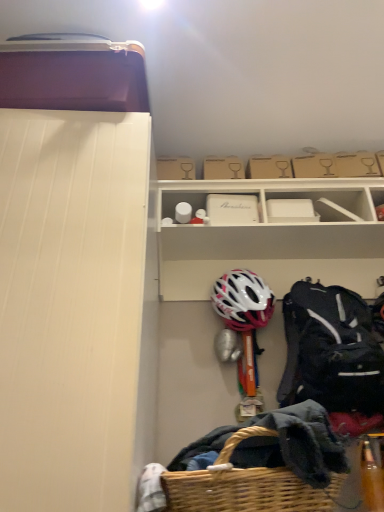
Question: From the image's perspective, relative to white matte storage box at upper center, the second storage box positioned from the top, is black synthetic backpack at right above or below?

Choices:
 (A) above
 (B) below

Answer: (B)

Question: Do you think black synthetic backpack at right is within white matte storage box at upper center, the second storage box positioned from the top, or outside of it?

Choices:
 (A) inside
 (B) outside

Answer: (B)

Question: Based on their relative distances, which object is nearer to the white plastic shelf at upper center?

Choices:
 (A) white matte storage box at upper center, the first storage box when ordered from bottom to top
 (B) white matte helmet at center
 (C) brown cardboard box at upper center, which is the 2th storage box in bottom-to-top order
 (D) black synthetic backpack at right
 (E) woven brown picnic basket at lower center

Answer: (A)

Question: Considering the real-world distances, which object is closest to the brown cardboard box at upper center, which is the 1th storage box in top-to-bottom order?

Choices:
 (A) woven brown picnic basket at lower center
 (B) white matte storage box at upper center, the first storage box when ordered from bottom to top
 (C) white plastic shelf at upper center
 (D) black synthetic backpack at right
 (E) white matte helmet at center

Answer: (B)